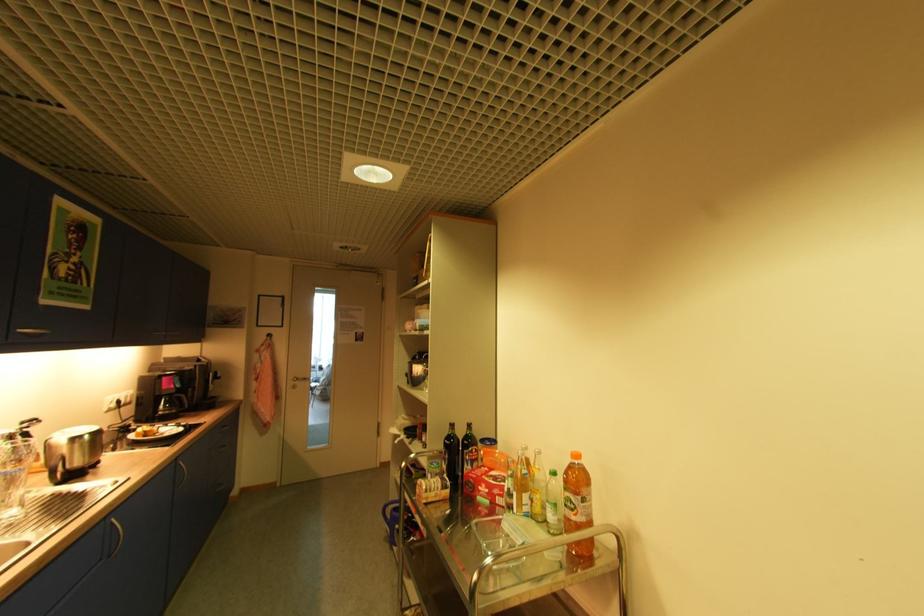
The height and width of the screenshot is (616, 924). Describe the element at coordinates (185, 402) in the screenshot. I see `the coffee pot handle` at that location.